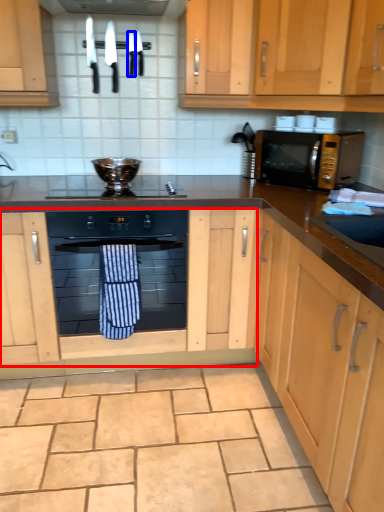
Question: Which object appears closest to the camera in this image, cabinetry (highlighted by a red box) or knife (highlighted by a blue box)?

Choices:
 (A) cabinetry
 (B) knife

Answer: (A)